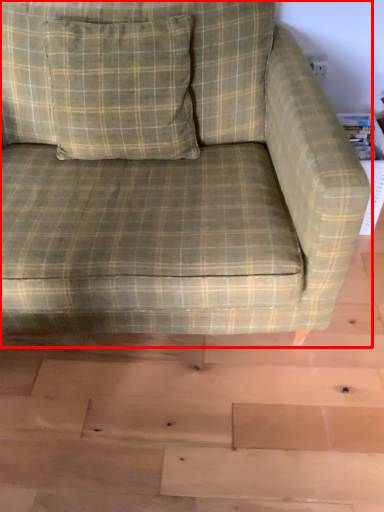
Question: In this image, where is studio couch (annotated by the red box) located relative to throw pillow?

Choices:
 (A) right
 (B) left

Answer: (A)